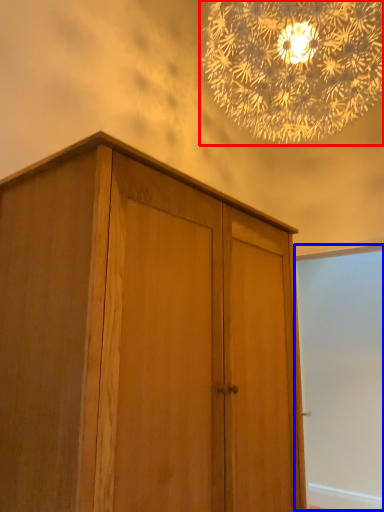
Question: Among these objects, which one is nearest to the camera, lamp (highlighted by a red box) or screen door (highlighted by a blue box)?

Choices:
 (A) lamp
 (B) screen door

Answer: (A)